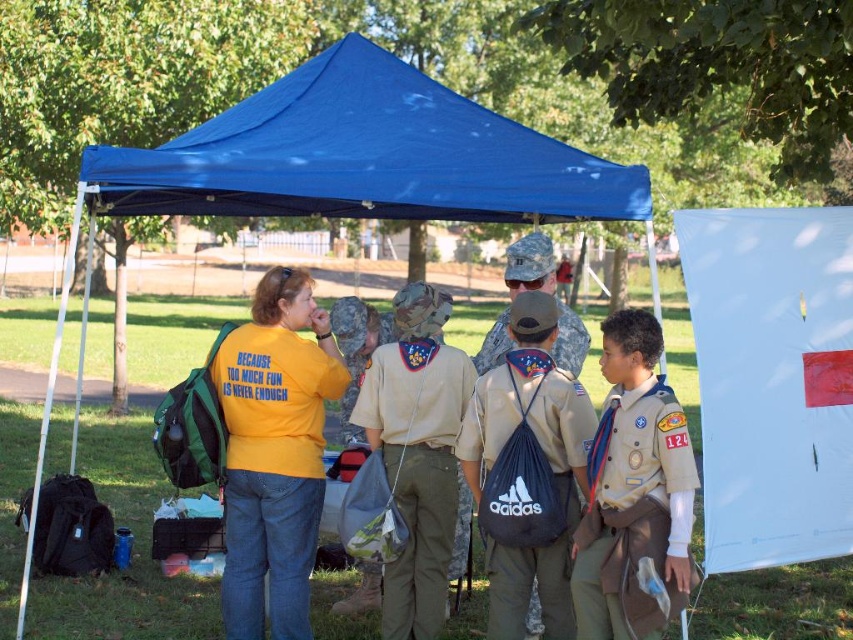
You are standing at the entrance of the blue canopy tent in the park. You notice two points marked in the scene. Which point is closer to you, point (x=173, y=170) or point (x=560, y=547)?

Point (x=173, y=170) is closer to you because it is further to the viewer than point (x=560, y=547).

Based on the photo, you are a person who is 5 feet 6 inches tall. You are standing under the blue fabric canopy at upper center and want to reach the brown canvas uniform at center. Can you stretch your hand to touch it without moving your feet?

The distance between the blue fabric canopy at upper center and the brown canvas uniform at center is 5.02 feet. Since you are 5 feet 6 inches tall, your maximum reach is approximately 5.5 feet. Therefore, you can stretch your hand to touch the brown canvas uniform at center from the blue fabric canopy at upper center without moving your feet.